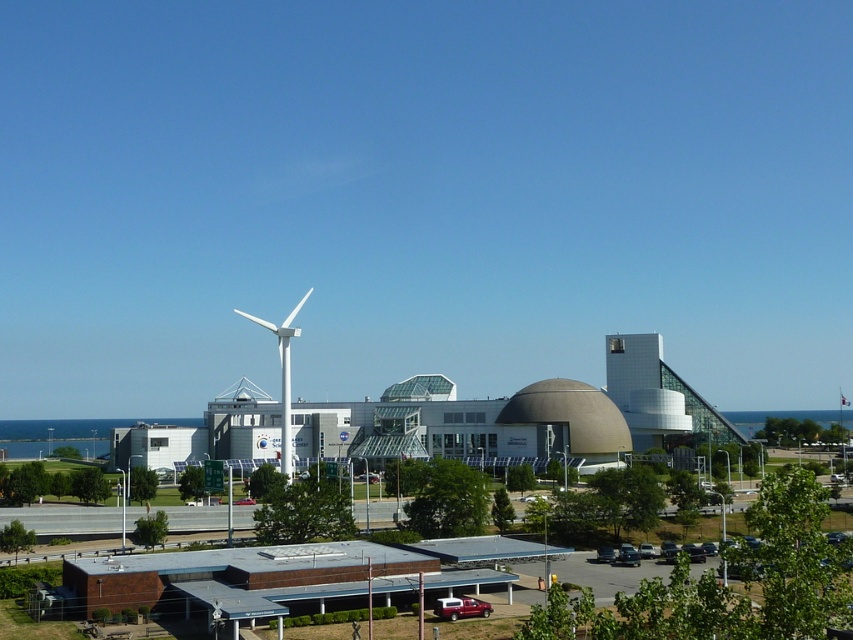
Question: Which point appears farthest from the camera in this image?

Choices:
 (A) (354, 476)
 (B) (288, 468)
 (C) (440, 612)

Answer: (A)

Question: Does metallic red pickup truck at lower center have a larger size compared to metallic silver car at center?

Choices:
 (A) no
 (B) yes

Answer: (A)

Question: Considering the relative positions of metallic red pickup truck at lower center and metallic silver car at center in the image provided, where is metallic red pickup truck at lower center located with respect to metallic silver car at center?

Choices:
 (A) below
 (B) above

Answer: (B)

Question: Which is nearer to the white matte windmill at center?

Choices:
 (A) metallic silver car at center
 (B) metallic red pickup truck at lower center

Answer: (A)

Question: Which point is closer to the camera?

Choices:
 (A) metallic red pickup truck at lower center
 (B) metallic silver car at center
 (C) white matte windmill at center

Answer: (A)

Question: From the image, what is the correct spatial relationship of metallic red pickup truck at lower center in relation to metallic silver car at center?

Choices:
 (A) left
 (B) right

Answer: (B)